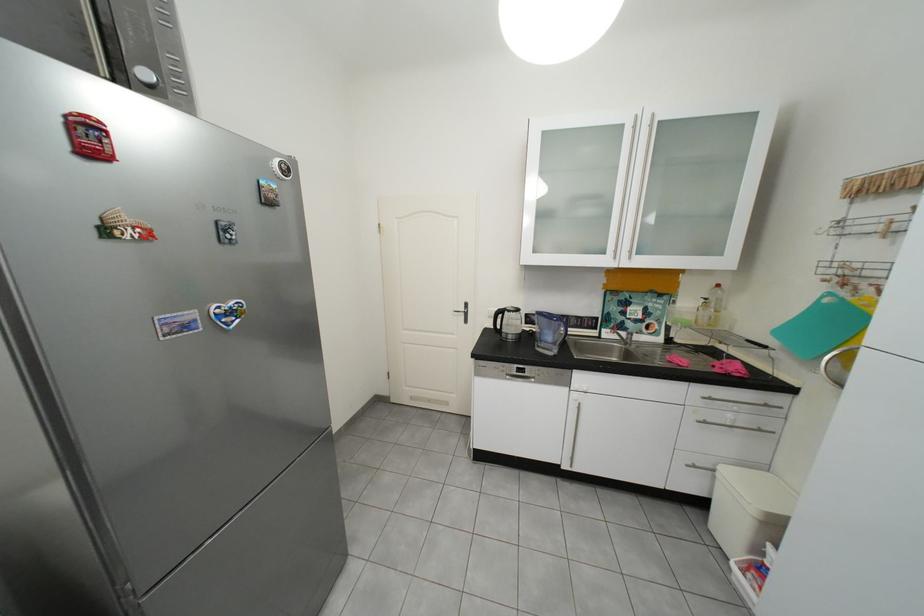
Find where to pull the sink faucet handle. Please return your answer as a coordinate pair (x, y).

(626, 336)